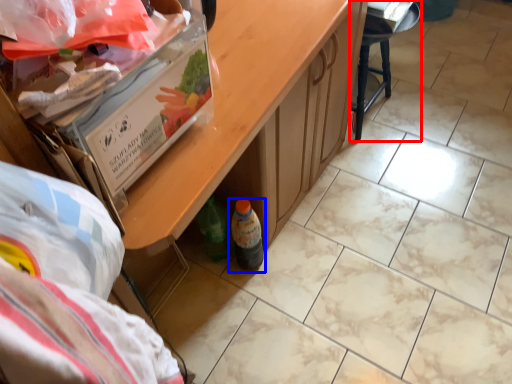
Question: Among these objects, which one is farthest to the camera, furniture (highlighted by a red box) or bottle (highlighted by a blue box)?

Choices:
 (A) furniture
 (B) bottle

Answer: (A)